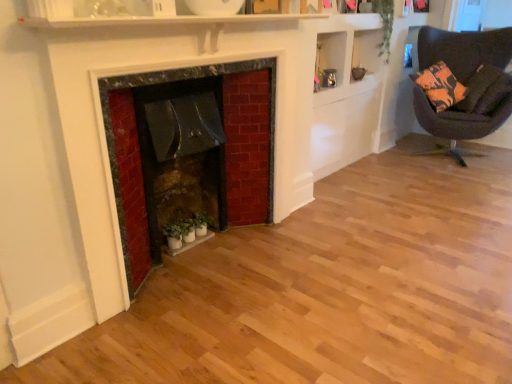
Question: In terms of size, does orange-patterned fabric pillow at upper right appear bigger or smaller than rustic stone fireplace at center?

Choices:
 (A) big
 (B) small

Answer: (B)

Question: From a real-world perspective, is orange-patterned fabric pillow at upper right positioned above or below rustic stone fireplace at center?

Choices:
 (A) below
 (B) above

Answer: (B)

Question: Considering the real-world distances, which object is closest to the orange-patterned fabric pillow at upper right?

Choices:
 (A) green matte plant at lower center, which appears as the second plant when viewed from the right
 (B) rustic stone fireplace at center
 (C) dark brown fabric chair at right
 (D) green leafy plant at upper right, which is counted as the first plant, starting from the top

Answer: (C)

Question: Which object is the closest to the green matte plant at lower center, the second plant when ordered from back to front?

Choices:
 (A) rustic stone fireplace at center
 (B) dark brown fabric chair at right
 (C) orange-patterned fabric pillow at upper right
 (D) green leafy plant at upper right, which is the second plant in bottom-to-top order

Answer: (A)